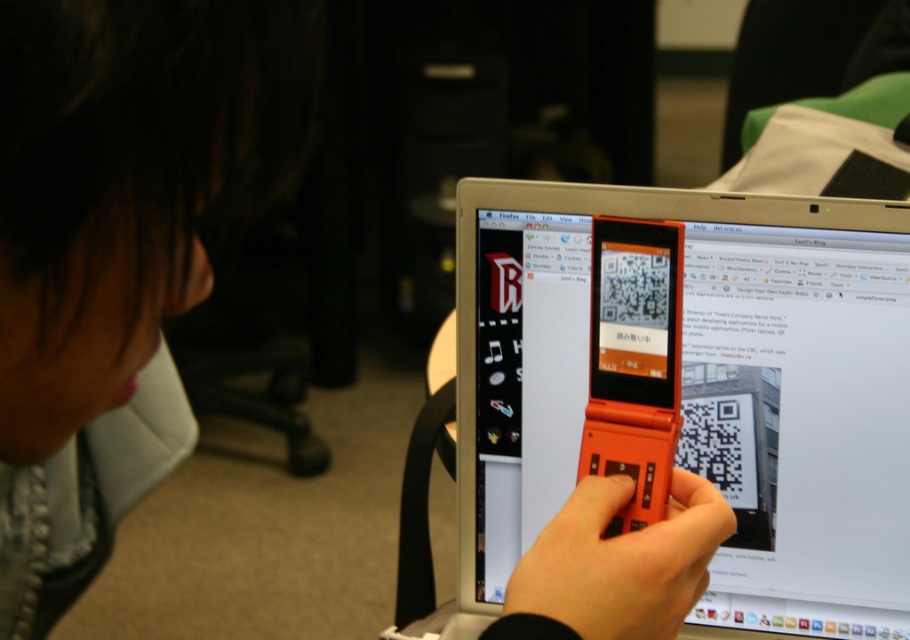
You are a delivery drone operator. Your drone is 20 inches in width and needs to pass through a narrow gap between the point at coordinate (574, 564) and the camera. Can the drone safely navigate through this gap without colliding?

The point at coordinate (574, 564) is 21.66 inches away from the camera. Since the drone is 20 inches wide, it can safely pass through the gap as the distance is greater than the drone width.

You are trying to scan a QR code on both the matte plastic screen at center and the orange matte flip phone at center. Which device is physically closer to you?

The matte plastic screen at center is closer to you because the orange matte flip phone at center is behind it.

You are trying to scan a QR code displayed on both the matte plastic screen at center and the orange matte phone at center. Which device should you aim your scanner at to ensure it reads the code first?

The matte plastic screen at center is positioned over the orange matte phone at center, so the scanner will read the QR code on the matte plastic screen at center first because it is closer to the scanner.